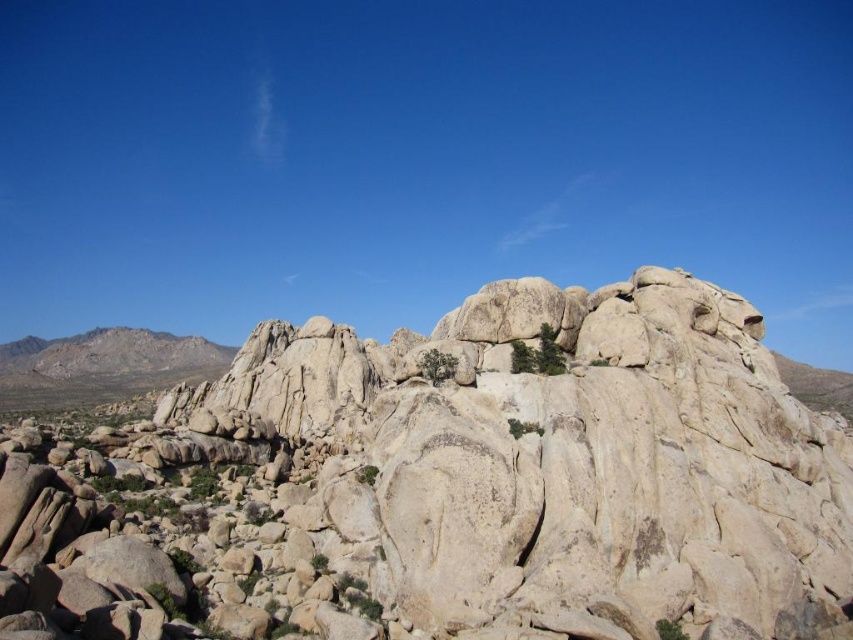
Who is taller, granite rock formation at center or rugged stone mountain at left?

With more height is granite rock formation at center.

Who is more distant from viewer, (554,531) or (201,364)?

Point (201,364)

Is point (781, 397) positioned in front of point (210, 353)?

That is True.

Identify the location of granite rock formation at center. This screenshot has width=853, height=640. click(456, 483).